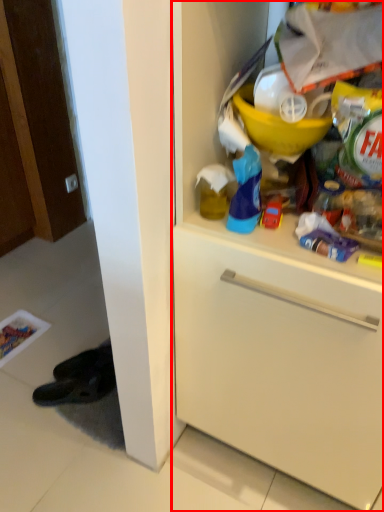
Question: Considering the relative positions of cabinetry (annotated by the red box) and toy in the image provided, where is cabinetry (annotated by the red box) located with respect to the staircase?

Choices:
 (A) right
 (B) left

Answer: (A)